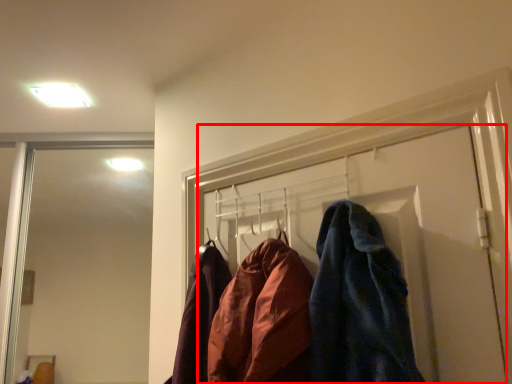
Question: From the image's perspective, what is the correct spatial relationship of door (annotated by the red box) in relation to light fixture?

Choices:
 (A) above
 (B) below

Answer: (B)